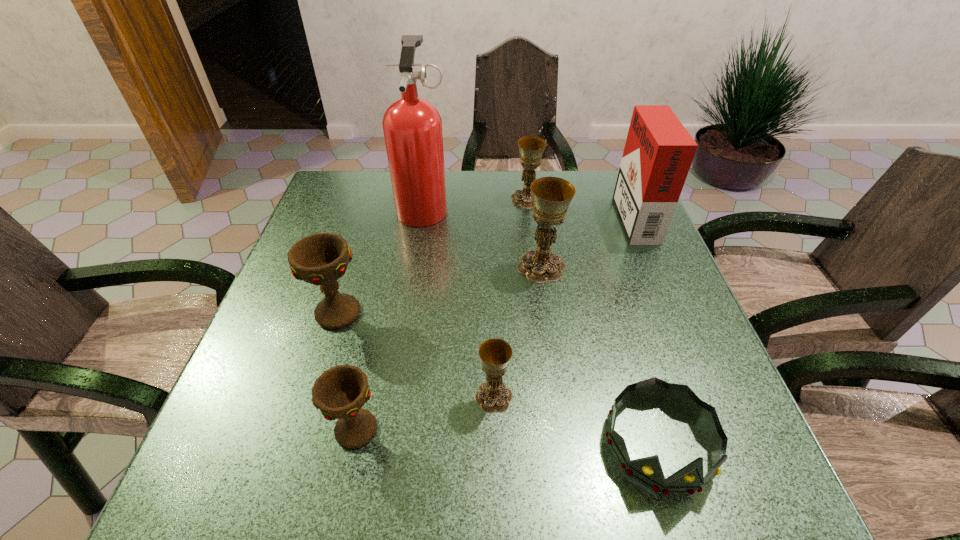
At what (x,y) coordinates should I click in order to perform the action: click on object that is positioned at the far right corner. Please return your answer as a coordinate pair (x, y). This screenshot has width=960, height=540. Looking at the image, I should click on (658, 153).

Where is `object positioned at the near right corner`? The height and width of the screenshot is (540, 960). object positioned at the near right corner is located at coordinates (648, 471).

I want to click on vacant area at the far edge of the desktop, so click(x=505, y=179).

Find the location of a particular element. vacant space at the near edge is located at coordinates (566, 465).

Where is `free region at the left edge of the desktop`? free region at the left edge of the desktop is located at coordinates (291, 322).

At what (x,y) coordinates should I click in order to perform the action: click on vacant space at the right edge of the desktop. Please return your answer as a coordinate pair (x, y). The image size is (960, 540). Looking at the image, I should click on (669, 415).

The width and height of the screenshot is (960, 540). In the image, there is a desktop. What are the coordinates of `vacant space at the near left corner` in the screenshot? It's located at (279, 478).

In the image, there is a desktop. Where is `free space at the far right corner`? This screenshot has width=960, height=540. free space at the far right corner is located at coordinates (608, 209).

Where is `vacant space at the near right corner of the desktop`? vacant space at the near right corner of the desktop is located at coordinates (708, 505).

Where is `unoccupied position between the second smallest gold chalice and the smaller red chalice`? unoccupied position between the second smallest gold chalice and the smaller red chalice is located at coordinates (442, 314).